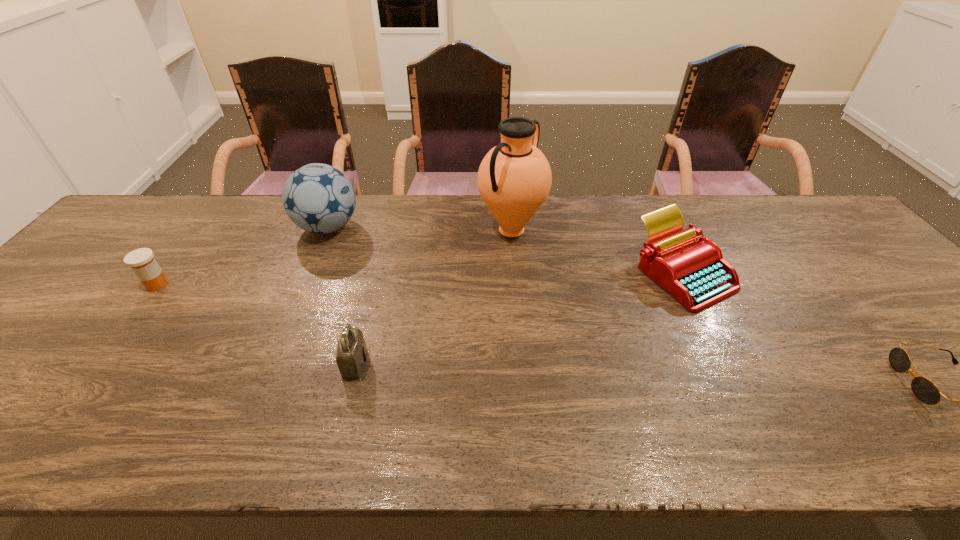
The image size is (960, 540). Identify the location of vacant area situated on the typing side of the second object from right to left. (719, 349).

Where is `vacant region located at the front of the fourth object from right to left near the keyhole`? vacant region located at the front of the fourth object from right to left near the keyhole is located at coordinates (510, 363).

What are the coordinates of `free spot located 0.190m on the label of the leftmost object` in the screenshot? It's located at (241, 285).

Locate an element on the screen. The height and width of the screenshot is (540, 960). pitcher at the far edge is located at coordinates (514, 178).

Where is `soccer ball present at the far edge`? This screenshot has height=540, width=960. soccer ball present at the far edge is located at coordinates (318, 198).

Locate an element on the screen. The height and width of the screenshot is (540, 960). typewriter that is at the far edge is located at coordinates (694, 273).

You are a GUI agent. You are given a task and a screenshot of the screen. Output one action in this format:
    pyautogui.click(x=<x>, y=<y>)
    Task: Click on the vacant region at the far edge of the desktop
    This screenshot has height=540, width=960.
    Given the screenshot: What is the action you would take?
    pyautogui.click(x=481, y=206)

Where is `vacant space at the near edge of the desktop`? The height and width of the screenshot is (540, 960). vacant space at the near edge of the desktop is located at coordinates coord(406,438).

In the image, there is a desktop. Where is `vacant area at the far left corner`? vacant area at the far left corner is located at coordinates (164, 195).

You are a GUI agent. You are given a task and a screenshot of the screen. Output one action in this format:
    pyautogui.click(x=<x>, y=<y>)
    Task: Click on the unoccupied area between the second object from right to left and the tallest object
    Image resolution: width=960 pixels, height=540 pixels.
    Given the screenshot: What is the action you would take?
    pyautogui.click(x=597, y=252)